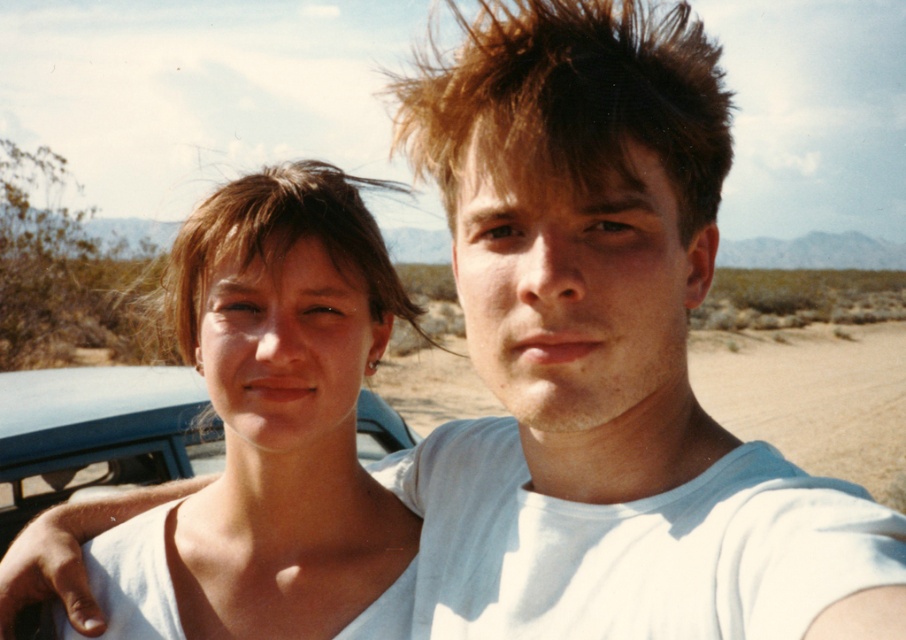
Question: Does matte white tank top at center come in front of brown spiky hair at upper right?

Choices:
 (A) no
 (B) yes

Answer: (A)

Question: Is matte white tank top at center in front of brown spiky hair at upper right?

Choices:
 (A) no
 (B) yes

Answer: (A)

Question: Is matte white tank top at center to the left of brown spiky hair at upper right from the viewer's perspective?

Choices:
 (A) yes
 (B) no

Answer: (A)

Question: Among these points, which one is nearest to the camera?

Choices:
 (A) (243, 218)
 (B) (678, 77)

Answer: (B)